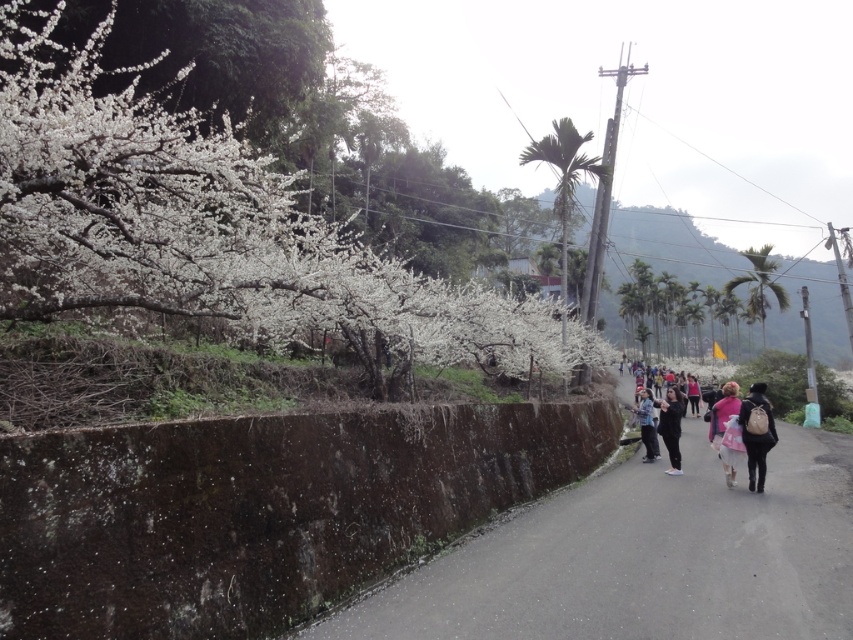
Can you confirm if dark brown asphalt road at center is shorter than black matte pants at center-right?

Correct, dark brown asphalt road at center is not as tall as black matte pants at center-right.

Identify the location of dark brown asphalt road at center. tap(643, 557).

Identify the location of dark brown asphalt road at center. (643, 557).

Who is positioned more to the left, black matte pants at center-right or pink fabric at center-right?

black matte pants at center-right

Is point (666, 401) closer to camera compared to point (698, 397)?

Yes.

Where is `black matte pants at center-right`? black matte pants at center-right is located at coordinates (671, 428).

Identify the location of black matte pants at center-right. The image size is (853, 640). (671, 428).

Is pink fabric bag at center-right positioned in front of pink fabric at center-right?

Yes, it is.

Does pink fabric bag at center-right appear over pink fabric at center-right?

Indeed, pink fabric bag at center-right is positioned over pink fabric at center-right.

Where is `pink fabric bag at center-right`? pink fabric bag at center-right is located at coordinates (727, 433).